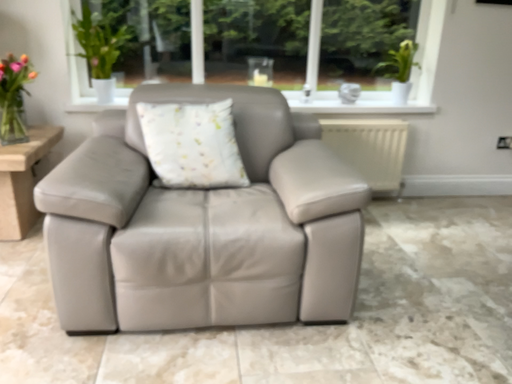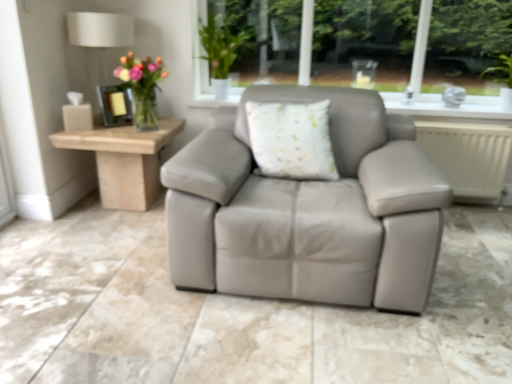
Question: How did the camera likely rotate when shooting the video?

Choices:
 (A) rotated right
 (B) rotated left

Answer: (B)